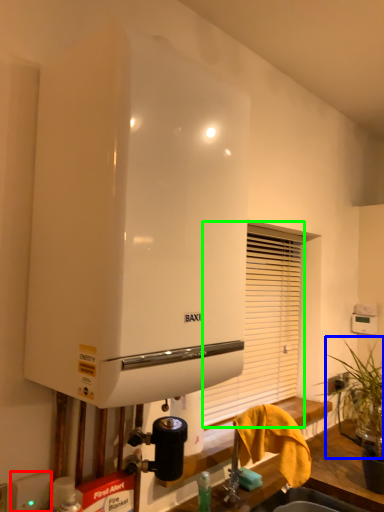
Question: Estimate the real-world distances between objects in this image. Which object is closer to electric outlet (highlighted by a red box), plant (highlighted by a blue box) or shutter (highlighted by a green box)?

Choices:
 (A) plant
 (B) shutter

Answer: (A)